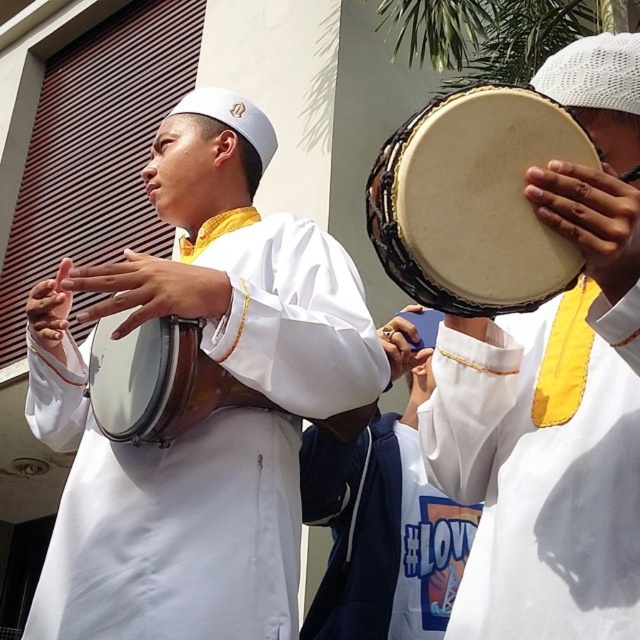
Question: Is matte white drum at center positioned in front of white matte hoodie at center?

Choices:
 (A) yes
 (B) no

Answer: (A)

Question: Among these objects, which one is nearest to the camera?

Choices:
 (A) white matte hoodie at center
 (B) matte white drum at center
 (C) white matte uniform at center
 (D) natural wood drum at center

Answer: (D)

Question: From the image, what is the correct spatial relationship of white matte uniform at center in relation to white matte hoodie at center?

Choices:
 (A) right
 (B) left

Answer: (A)

Question: Is matte white drum at center positioned behind white matte uniform at center?

Choices:
 (A) no
 (B) yes

Answer: (A)

Question: Which point is closer to the camera taking this photo?

Choices:
 (A) (400, 170)
 (B) (212, 486)
 (C) (515, 474)

Answer: (A)

Question: Which object is closer to the camera taking this photo?

Choices:
 (A) matte white drum at center
 (B) natural wood drum at center
 (C) white matte uniform at center

Answer: (B)